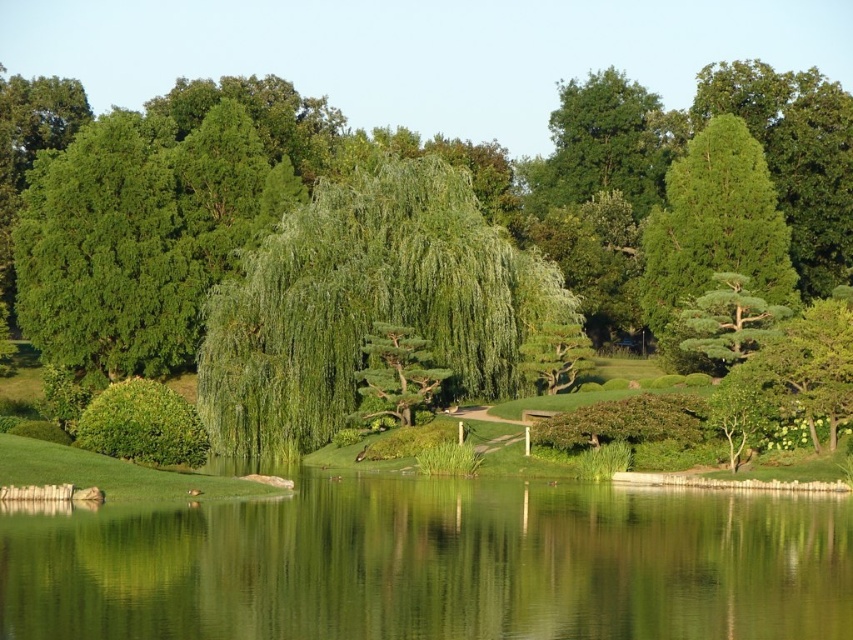
You are standing in a Japanese garden and want to take a photo of the green leafy tree at center. If your camera can focus on objects up to 50 meters away, will you be able to capture a clear image of the tree?

The green leafy tree at center is 57.49 meters away from the camera, which exceeds the camera focus range of 50 meters. Therefore, the camera cannot capture a clear image of the green leafy tree at center.

You are a landscape architect designing a new garden. You need to place a small wooden bridge that is 2 meters wide. The bridge must span from the left edge of the green reflective water at center to the right edge of the green textured tree at upper right. Based on the scene description, will the bridge fit properly between these two points?

The green reflective water at center is wider than the green textured tree at upper right. Since the bridge is 2 meters wide, it should fit properly between the left edge of the green reflective water at center and the right edge of the green textured tree at upper right, as the water is wider, providing enough space for the bridge.

You are designing a garden layout and need to place a new bench between the green leafy willow at center and the green textured tree at upper right. Considering their widths, which tree should the bench be closer to to ensure it doesn

The bench should be closer to the green textured tree at upper right because the green leafy willow at center is wider, so placing the bench closer to the narrower tree would provide more balanced spacing between the two trees.